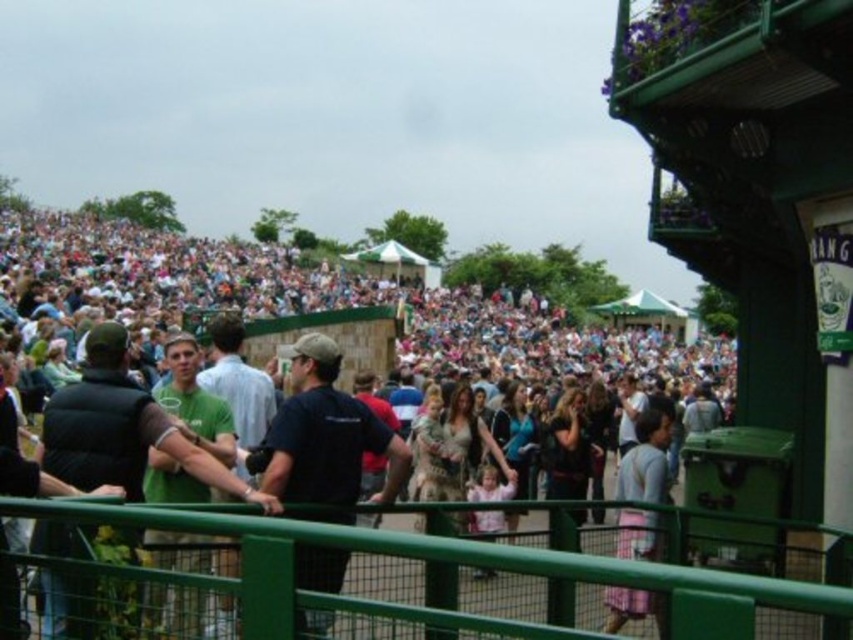
At what (x,y) coordinates should I click in order to perform the action: click on green painted metal fence at lower center. Please return your answer as a coordinate pair (x, y). The height and width of the screenshot is (640, 853). Looking at the image, I should click on (460, 564).

Is green painted metal fence at lower center thinner than pink fabric dress at lower right?

In fact, green painted metal fence at lower center might be wider than pink fabric dress at lower right.

You are a GUI agent. You are given a task and a screenshot of the screen. Output one action in this format:
    pyautogui.click(x=<x>, y=<y>)
    Task: Click on the green painted metal fence at lower center
    This screenshot has width=853, height=640.
    Given the screenshot: What is the action you would take?
    pyautogui.click(x=460, y=564)

This screenshot has height=640, width=853. Identify the location of green painted metal fence at lower center. (460, 564).

Does green painted metal fence at lower center have a smaller size compared to dark blue t-shirt at center?

Indeed, green painted metal fence at lower center has a smaller size compared to dark blue t-shirt at center.

Locate an element on the screen. This screenshot has width=853, height=640. green painted metal fence at lower center is located at coordinates (460, 564).

Identify the location of green painted metal fence at lower center. This screenshot has height=640, width=853. (460, 564).

Does matte black crowd at center lie in front of green fabric jacket at left?

No, matte black crowd at center is further to the viewer.

Is point (631, 356) closer to viewer compared to point (126, 380)?

No, (631, 356) is further to viewer.

I want to click on matte black crowd at center, so click(x=181, y=288).